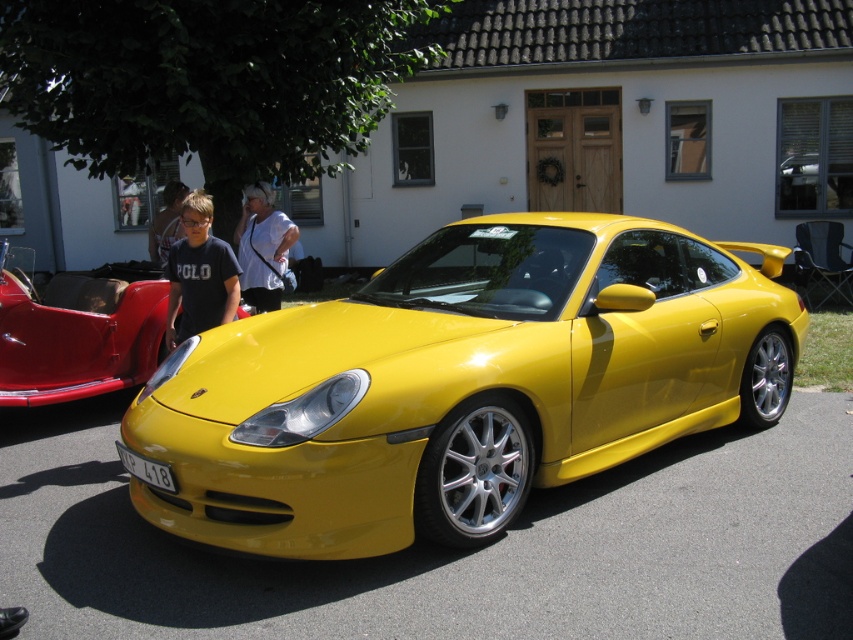
You are standing next to the Porsche sports car and want to reach the wooden door of the building. There is a matte black shirt at left in your way. Can you walk around it to reach the door?

The Porsche sports car and the wooden door are 5.01 meters apart. Since the matte black shirt at left is an object in your path, you can walk around it to reach the door as the distance allows for maneuvering.

You are standing in front of the white building with the dark tiled roof and see the vibrant yellow Porsche sports car parked outdoors. You notice a point labeled as point (199, 275). What object is located at this point?

The point (199, 275) indicates the matte black shirt at left.

You are a photographer trying to capture a clear shot of the glossy yellow car at center and the white plastic license plate at lower center. Which object will appear larger in your photo?

The glossy yellow car at center will appear larger in the photo because it is closer to the camera than the white plastic license plate at lower center.